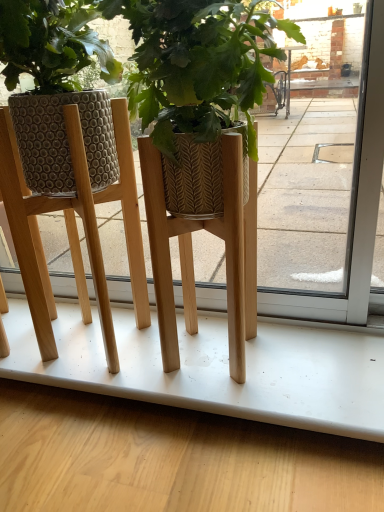
Locate an element on the screen. Image resolution: width=384 pixels, height=512 pixels. wooden floor at lower center is located at coordinates (170, 458).

What is the approximate height of wooden floor at lower center?

8.81 inches.

What do you see at coordinates (170, 458) in the screenshot? I see `wooden floor at lower center` at bounding box center [170, 458].

Describe the element at coordinates (71, 198) in the screenshot. This screenshot has height=512, width=384. I see `wooden planter at center` at that location.

The width and height of the screenshot is (384, 512). I want to click on wooden planter at center, so click(x=71, y=198).

Measure the distance between wooden planter at center and camera.

wooden planter at center is 59.88 centimeters away from camera.

The width and height of the screenshot is (384, 512). What are the coordinates of `wooden floor at lower center` in the screenshot? It's located at (170, 458).

Would you say wooden planter at center is to the left or to the right of wooden floor at lower center in the picture?

wooden planter at center is positioned on wooden floor at lower center's left side.

Does wooden planter at center come behind wooden floor at lower center?

No, the depth of wooden planter at center is less than that of wooden floor at lower center.

Considering the positions of point (95, 161) and point (110, 457), is point (95, 161) closer or farther from the camera than point (110, 457)?

Clearly, point (95, 161) is more distant from the camera than point (110, 457).

From the image's perspective, is wooden planter at center positioned above or below wooden floor at lower center?

wooden planter at center is above wooden floor at lower center.

From a real-world perspective, who is located lower, wooden planter at center or wooden floor at lower center?

From a 3D spatial view, wooden floor at lower center is below.

Does wooden planter at center have a greater width compared to wooden floor at lower center?

Correct, the width of wooden planter at center exceeds that of wooden floor at lower center.

Considering the sizes of wooden planter at center and wooden floor at lower center in the image, is wooden planter at center taller or shorter than wooden floor at lower center?

wooden planter at center is taller than wooden floor at lower center.

Which of these two, wooden planter at center or wooden floor at lower center, is smaller?

With smaller size is wooden planter at center.

Is wooden planter at center located outside wooden floor at lower center?

wooden planter at center is positioned outside wooden floor at lower center.

Is wooden planter at center not near wooden floor at lower center?

wooden planter at center is actually quite close to wooden floor at lower center.

From the picture: Could you tell me if wooden planter at center is turned towards wooden floor at lower center?

No, wooden planter at center is not oriented towards wooden floor at lower center.

Image resolution: width=384 pixels, height=512 pixels. I want to click on pavement below the wooden planter at center (from a real-world perspective), so click(170, 458).

Which is more to the left, wooden floor at lower center or wooden planter at center?

wooden planter at center is more to the left.

Which is behind, wooden floor at lower center or wooden planter at center?

wooden floor at lower center is further from the camera.

Is point (164, 461) farther from viewer compared to point (25, 130)?

Yes, it is.

From the image's perspective, does wooden floor at lower center appear lower than wooden planter at center?

Correct, wooden floor at lower center appears lower than wooden planter at center in the image.

From a real-world perspective, which object rests below the other?

wooden floor at lower center is physically lower.

Can you confirm if wooden floor at lower center is thinner than wooden planter at center?

Yes, wooden floor at lower center is thinner than wooden planter at center.

Is wooden floor at lower center taller or shorter than wooden planter at center?

Considering their sizes, wooden floor at lower center has less height than wooden planter at center.

Considering the relative sizes of wooden floor at lower center and wooden planter at center in the image provided, is wooden floor at lower center bigger than wooden planter at center?

Indeed, wooden floor at lower center has a larger size compared to wooden planter at center.

Based on the photo, is wooden floor at lower center spatially inside wooden planter at center, or outside of it?

wooden floor at lower center cannot be found inside wooden planter at center.

Is wooden floor at lower center directly adjacent to wooden planter at center?

wooden floor at lower center and wooden planter at center are not in contact.

Is wooden floor at lower center facing away from wooden planter at center?

No, wooden floor at lower center is not facing the opposite direction of wooden planter at center.

I want to click on furniture above the wooden floor at lower center (from the image's perspective), so (71, 198).

Find the location of a particular element. Image resolution: width=384 pixels, height=512 pixels. pavement below the wooden planter at center (from the image's perspective) is located at coordinates (170, 458).

Find the location of a particular element. The height and width of the screenshot is (512, 384). furniture above the wooden floor at lower center (from the image's perspective) is located at coordinates (71, 198).